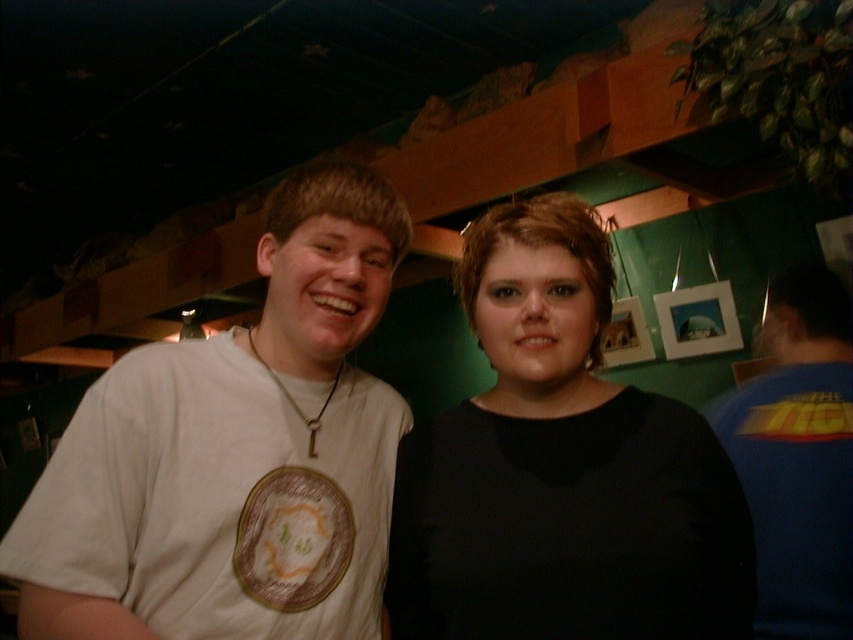
Question: Among these points, which one is farthest from the camera?

Choices:
 (A) (288, 621)
 (B) (491, 496)

Answer: (B)

Question: Considering the real-world distances, which object is farthest from the white cotton t-shirt at left?

Choices:
 (A) blue jersey at right
 (B) black matte shirt at center

Answer: (A)

Question: Which point is farther to the camera?

Choices:
 (A) white cotton t-shirt at left
 (B) black matte shirt at center

Answer: (B)

Question: Does black matte shirt at center appear on the right side of blue jersey at right?

Choices:
 (A) no
 (B) yes

Answer: (A)

Question: Is white cotton t-shirt at left wider than blue jersey at right?

Choices:
 (A) yes
 (B) no

Answer: (A)

Question: Can you confirm if white cotton t-shirt at left is smaller than black matte shirt at center?

Choices:
 (A) no
 (B) yes

Answer: (A)